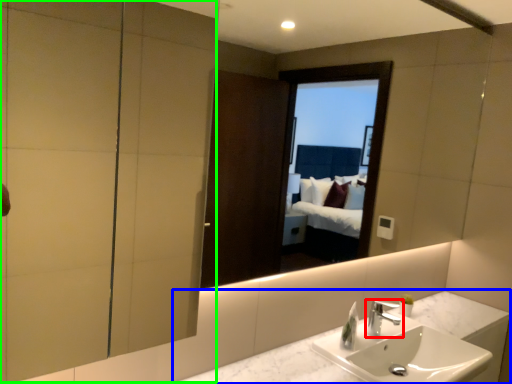
Question: Which object is the farthest from tap (highlighted by a red box)? Choose among these: counter top (highlighted by a blue box) or screen door (highlighted by a green box).

Choices:
 (A) counter top
 (B) screen door

Answer: (B)